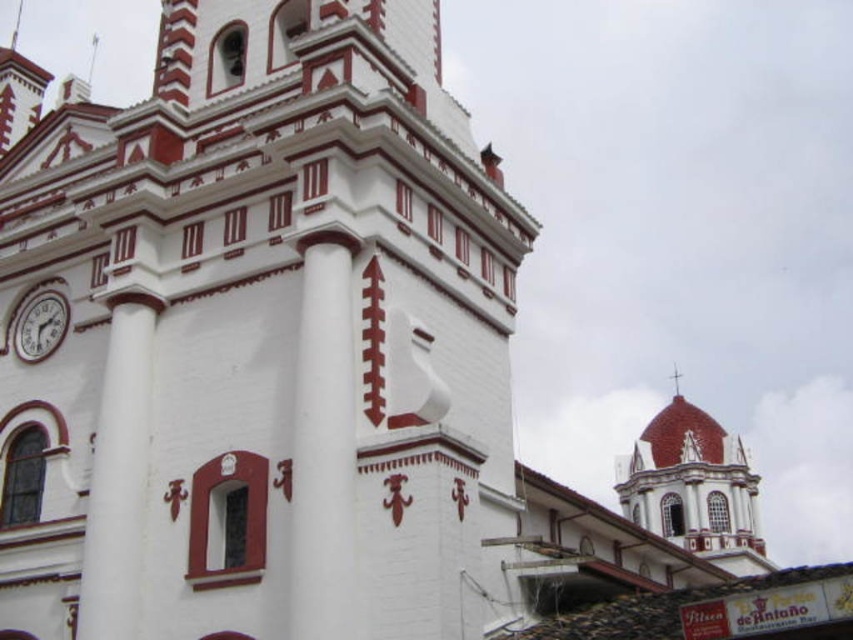
Based on the photo, you are an architect designing a new building and want to place a decorative element exactly at the location of the white smooth column at left in the image. What are the coordinates where you should place this element?

The coordinates for the white smooth column at left are at point (119,476), so you should place the decorative element at those coordinates.

You are standing in front of the building and want to determine the relative positions of two points marked on the facade. Which of the two points, point (x=323, y=358) or point (x=712, y=520), is closer to you?

Point (x=323, y=358) is closer to the viewer than point (x=712, y=520).

You are standing in front of the building and notice two points marked on the facade. The first point is at coordinates point (323,592), and the second is at point (103,406). Which of these points is closer to you?

Point (323,592) is in front of point (103,406), so it is closer to you.